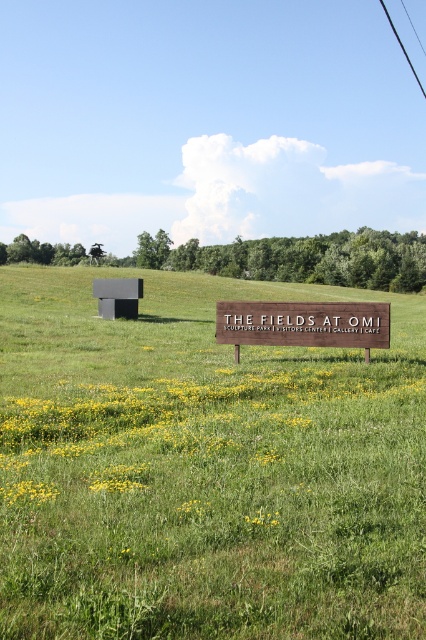
Consider the image. You are standing at the wooden sign and want to walk to the cafe located at the point with coordinates point (x=385, y=317). However, there is another point point (x=164, y=396) blocking your path. Can you walk directly to the cafe without going around?

Point (x=164, y=396) is in front of point (x=385, y=317), so you cannot walk directly to the cafe located at point (x=385, y=317) without going around the blocking point (x=164, y=396).

You are standing at the center of the grassy field and want to locate the black matte sculpture at upper left. According to the coordinates given, in which direction should you walk to find it?

The black matte sculpture at upper left is located at coordinates point (x=204, y=468). Since the coordinate system is not specified, but assuming standard image coordinates where the origin is at the bottom left corner, the x value of 0.734 indicates a position to the right and the y value of 0.481 indicates a position above the center. Therefore, you should walk towards the upper right direction to find the black matte sculpture at upper left.